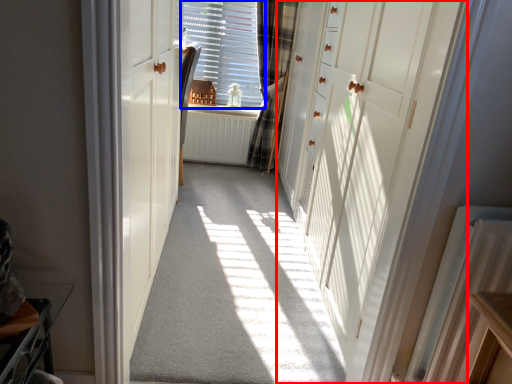
Question: Among these objects, which one is nearest to the camera, door (highlighted by a red box) or window (highlighted by a blue box)?

Choices:
 (A) door
 (B) window

Answer: (A)